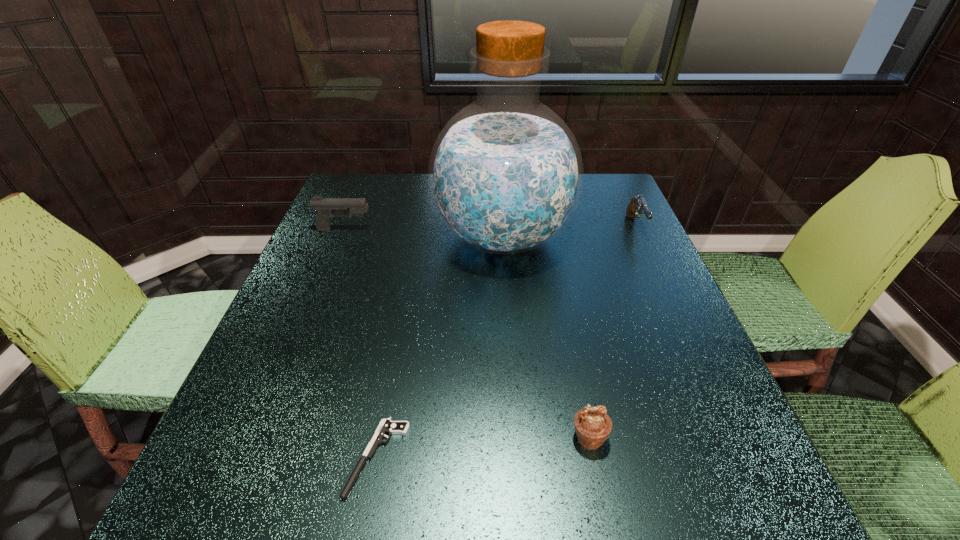
Locate an element on the screen. free region at the left edge is located at coordinates (314, 268).

You are a GUI agent. You are given a task and a screenshot of the screen. Output one action in this format:
    pyautogui.click(x=<x>, y=<y>)
    Task: Click on the vacant space at the right edge of the desktop
    The height and width of the screenshot is (540, 960).
    Given the screenshot: What is the action you would take?
    pyautogui.click(x=636, y=218)

At what (x,y) coordinates should I click in order to perform the action: click on vacant space at the far right corner of the desktop. Please return your answer as a coordinate pair (x, y). Looking at the image, I should click on (604, 185).

At what (x,y) coordinates should I click in order to perform the action: click on vacant space at the near right corner of the desktop. Please return your answer as a coordinate pair (x, y). This screenshot has width=960, height=540. Looking at the image, I should click on (695, 490).

The width and height of the screenshot is (960, 540). Identify the location of vacant area that lies between the leftmost object and the nearest pistol. (361, 344).

Identify the location of unoccupied area between the rightmost pistol and the tallest object. Image resolution: width=960 pixels, height=540 pixels. (569, 232).

The height and width of the screenshot is (540, 960). Identify the location of free area in between the water jug and the leftmost object. (423, 233).

Find the location of a particular element. This screenshot has height=540, width=960. free point between the leftmost pistol and the shortest pistol is located at coordinates (361, 344).

You are a GUI agent. You are given a task and a screenshot of the screen. Output one action in this format:
    pyautogui.click(x=<x>, y=<y>)
    Task: Click on the empty space between the muffin and the second pistol from right to left
    The width and height of the screenshot is (960, 540).
    Given the screenshot: What is the action you would take?
    (x=483, y=448)

Find the location of a particular element. This screenshot has height=540, width=960. free spot between the nearest pistol and the leftmost pistol is located at coordinates (361, 344).